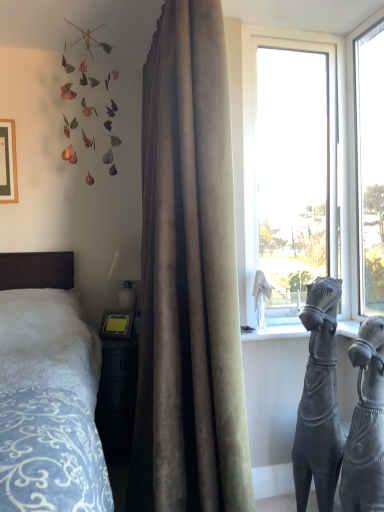
Question: In terms of height, does metallic leaf mobile at upper left look taller or shorter compared to transparent glass window at center, which appears as the 1th window when viewed from the left?

Choices:
 (A) tall
 (B) short

Answer: (B)

Question: Considering the relative positions of metallic leaf mobile at upper left and transparent glass window at center, positioned as the second window in right-to-left order, in the image provided, is metallic leaf mobile at upper left to the left or to the right of transparent glass window at center, positioned as the second window in right-to-left order,?

Choices:
 (A) left
 (B) right

Answer: (A)

Question: Estimate the real-world distances between objects in this image. Which object is farther from the gray stone horse at right, which is the first sculpture in bottom-to-top order?

Choices:
 (A) transparent glass sculpture at window, the 2th sculpture in the bottom-to-top sequence
 (B) bronze statue at right
 (C) transparent glass window at upper right, which is the 1th window from right to left
 (D) satin curtain at center
 (E) metallic leaf mobile at upper left

Answer: (E)

Question: Which is farther from the transparent glass window at center, positioned as the second window in right-to-left order?

Choices:
 (A) bronze statue at right
 (B) matte black picture frame at upper left
 (C) metallic leaf mobile at upper left
 (D) transparent glass window at upper right, which is the 1th window from right to left
 (E) satin curtain at center

Answer: (B)